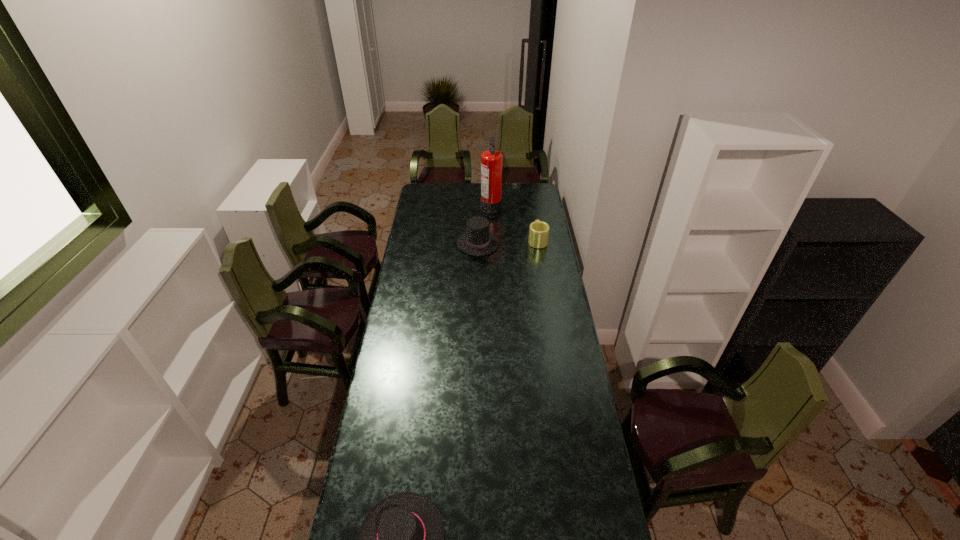
Identify which object is the second nearest to the farthest object. Please provide its 2D coordinates. Your answer should be formatted as a tuple, i.e. [(x, y)], where the tuple contains the x and y coordinates of a point satisfying the conditions above.

[(538, 231)]

Select which object appears as the second closest to the nearest object. Please provide its 2D coordinates. Your answer should be formatted as a tuple, i.e. [(x, y)], where the tuple contains the x and y coordinates of a point satisfying the conditions above.

[(538, 231)]